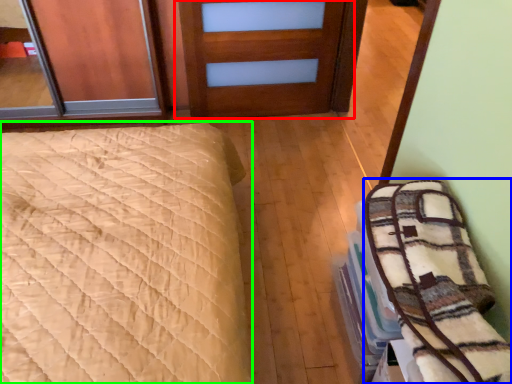
Question: Which object is the closest to the door (highlighted by a red box)? Choose among these: bedding (highlighted by a blue box) or bed (highlighted by a green box).

Choices:
 (A) bedding
 (B) bed

Answer: (B)